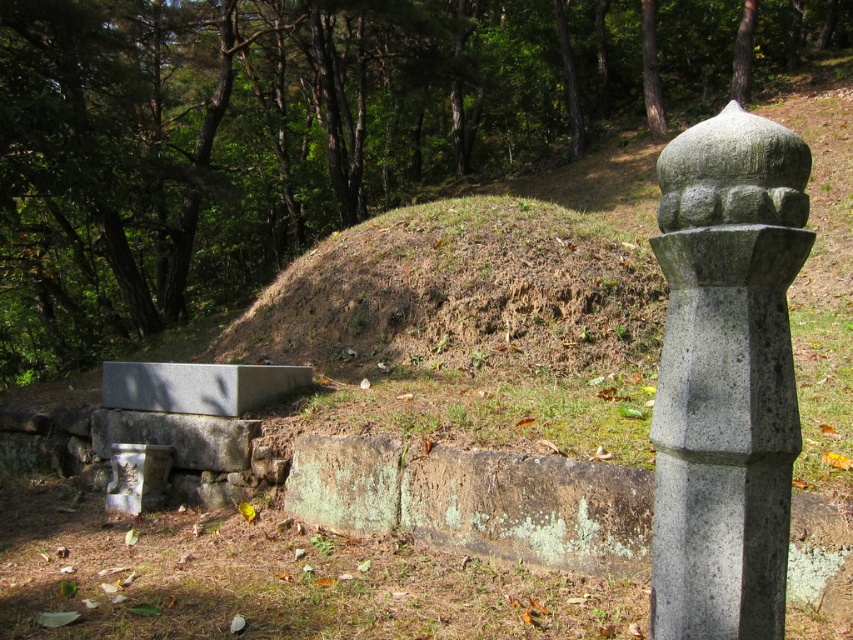
Question: Is the position of green leafy tree at upper center less distant than that of gray concrete bench at lower left?

Choices:
 (A) no
 (B) yes

Answer: (A)

Question: Does gray stone post at right appear on the left side of brown grassy mound at center?

Choices:
 (A) no
 (B) yes

Answer: (A)

Question: Which point is farther to the camera?

Choices:
 (A) (289, 372)
 (B) (718, 595)
 (C) (705, 44)
 (D) (622, 259)

Answer: (C)

Question: Which point is farther to the camera?

Choices:
 (A) (136, 404)
 (B) (358, 26)

Answer: (B)

Question: Which object appears farthest from the camera in this image?

Choices:
 (A) gray concrete bench at lower left
 (B) gray stone post at right
 (C) brown grassy mound at center
 (D) green leafy tree at upper center

Answer: (D)

Question: Where is green leafy tree at upper center located in relation to gray stone post at right in the image?

Choices:
 (A) right
 (B) left

Answer: (A)